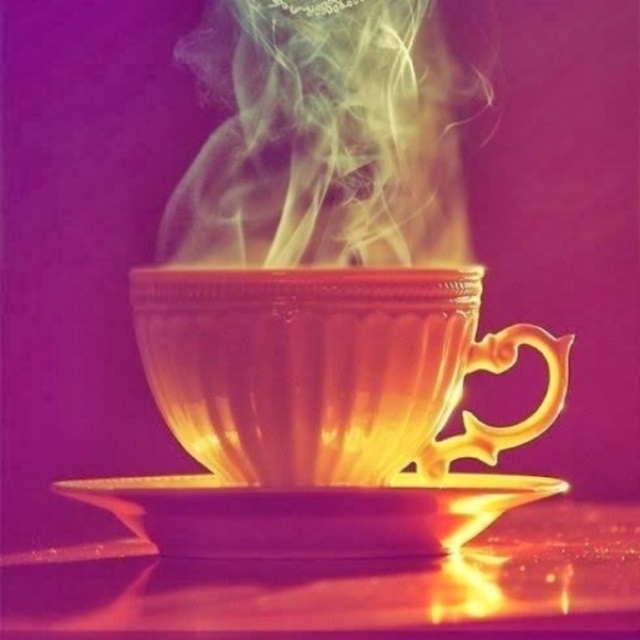
You are an AI analyzing the positions of two points in the image. The first point is at coordinates point (211, 400) and the second is at point (358, 536). Based on the scene description, which point is closer to the viewer?

Point (358, 536) is closer to the viewer than point (211, 400) because the description states that point (211, 400) is behind point (358, 536).